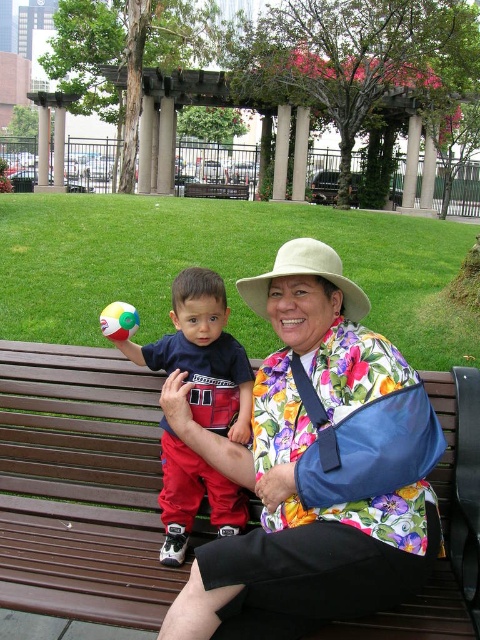
You are planning to place a small potted plant between the matte blue shirt at center and the brown wooden bench at center. Based on their sizes, will the plant fit comfortably without overcrowding the area?

The matte blue shirt at center occupies less space than the brown wooden bench at center, so placing a small potted plant between them should fit comfortably as there is enough space between the two objects.

You are a photographer trying to capture the perfect shot of the older woman and the child in the park. You notice a specific point at coordinates point (304, 275). Where is this point located in the scene?

The point (304, 275) is on the beige fabric cowboy hat at center.

You are a photographer trying to capture a photo of the matte blue shirt at center and the multicolored rubber beach ball at left. Since the shirt is in front of the beach ball, will you need to adjust your camera angle to ensure both are visible in the photo?

The matte blue shirt at center is in front of the multicolored rubber beach ball at left, so you will need to adjust your camera angle to ensure both are visible in the photo.